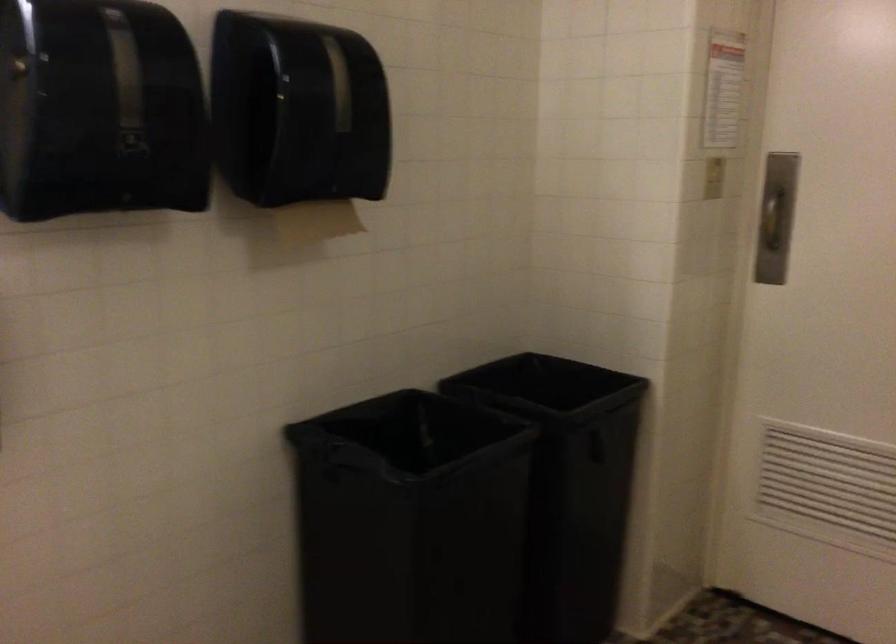
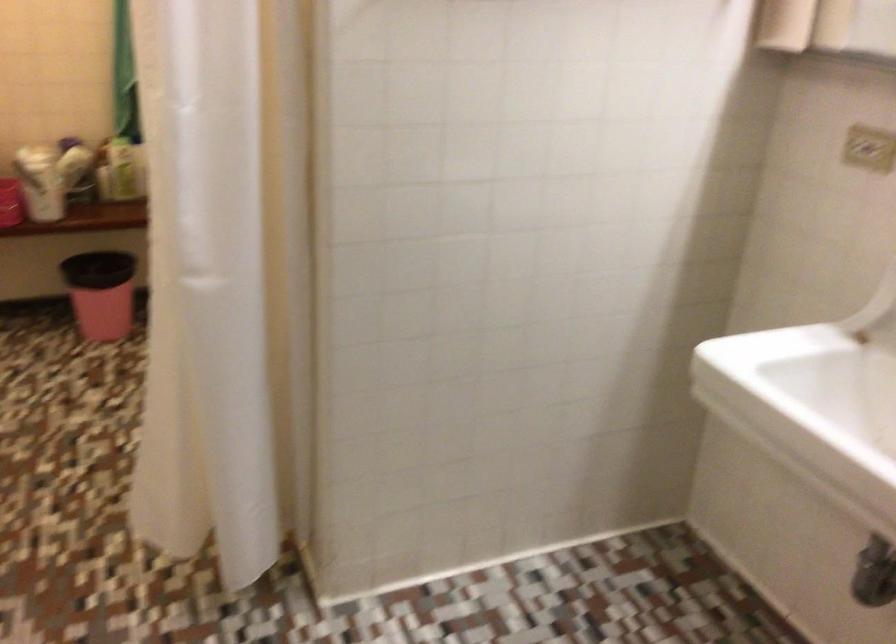
Based on the continuous images, in which direction is the camera rotating?

The camera's rotation is toward left-down.